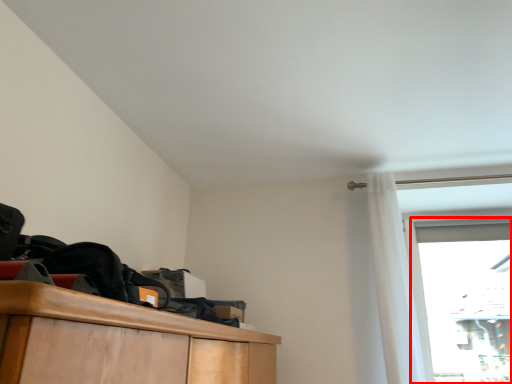
Question: From the image's perspective, where is glass door (annotated by the red box) located relative to curtain?

Choices:
 (A) below
 (B) above

Answer: (A)